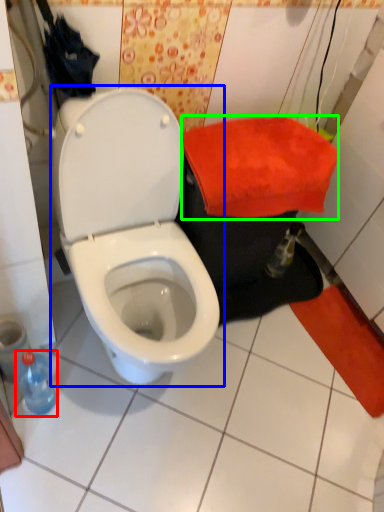
Question: Based on their relative distances, which object is farther from bottle (highlighted by a red box)? Choose from toilet (highlighted by a blue box) and beach towel (highlighted by a green box).

Choices:
 (A) toilet
 (B) beach towel

Answer: (B)